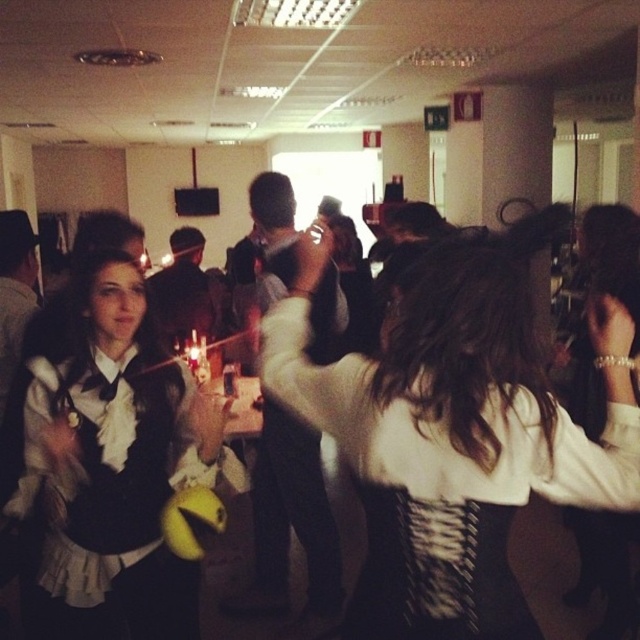
You are planning to take a photo of the white textured fabric at center and the matte black dress at center. Since both are at the center, how can you ensure both are fully visible in the frame?

The white textured fabric at center is bigger than the matte black dress at center, so you should position your camera to focus on the larger object first and adjust the zoom to include both in the frame.